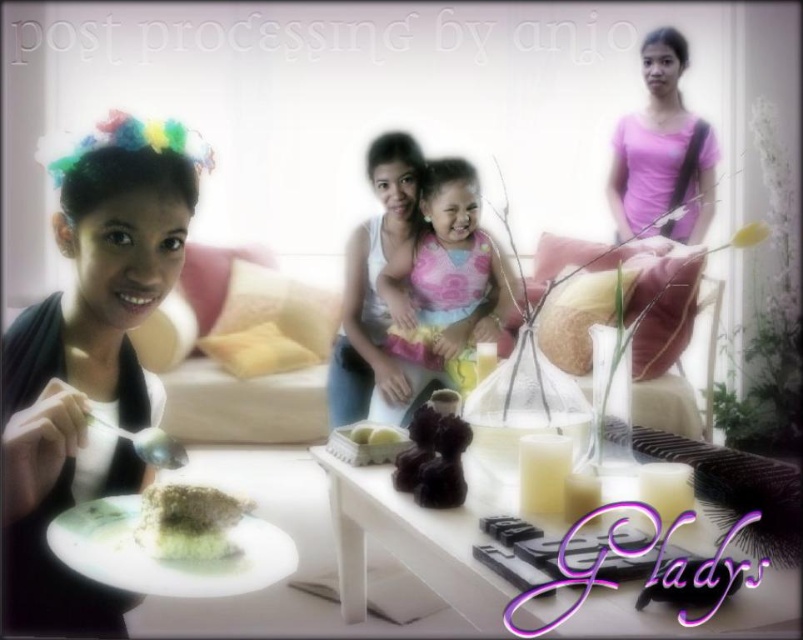
Question: Which point is farther to the camera?

Choices:
 (A) green matte plate at lower left
 (B) matte black cake at lower left
 (C) pink fabric dress at center
 (D) pink cotton shirt at upper right

Answer: (D)

Question: Can you confirm if white glossy table at center is smaller than pink fabric dress at center?

Choices:
 (A) yes
 (B) no

Answer: (B)

Question: Does pink fabric dress at center lie in front of green matte plate at lower left?

Choices:
 (A) no
 (B) yes

Answer: (A)

Question: Which is nearer to the matte black cake at lower left?

Choices:
 (A) pink cotton shirt at upper right
 (B) white glossy table at center

Answer: (B)

Question: Which point is closer to the camera?

Choices:
 (A) green matte plate at lower left
 (B) pink fabric dress at center
 (C) pink cotton shirt at upper right
 (D) green crumbly cake at lower left

Answer: (A)

Question: Is white glossy table at center wider than pink fabric dress at center?

Choices:
 (A) no
 (B) yes

Answer: (B)